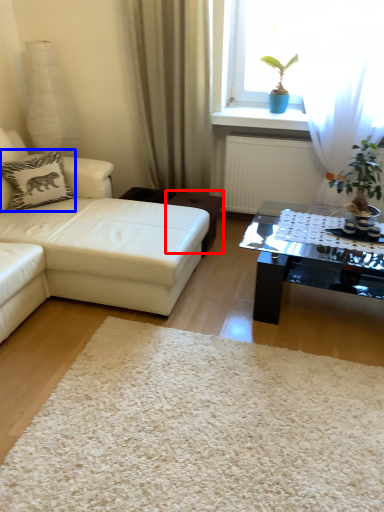
Question: Which object appears closest to the camera in this image, stool (highlighted by a red box) or pillow (highlighted by a blue box)?

Choices:
 (A) stool
 (B) pillow

Answer: (B)